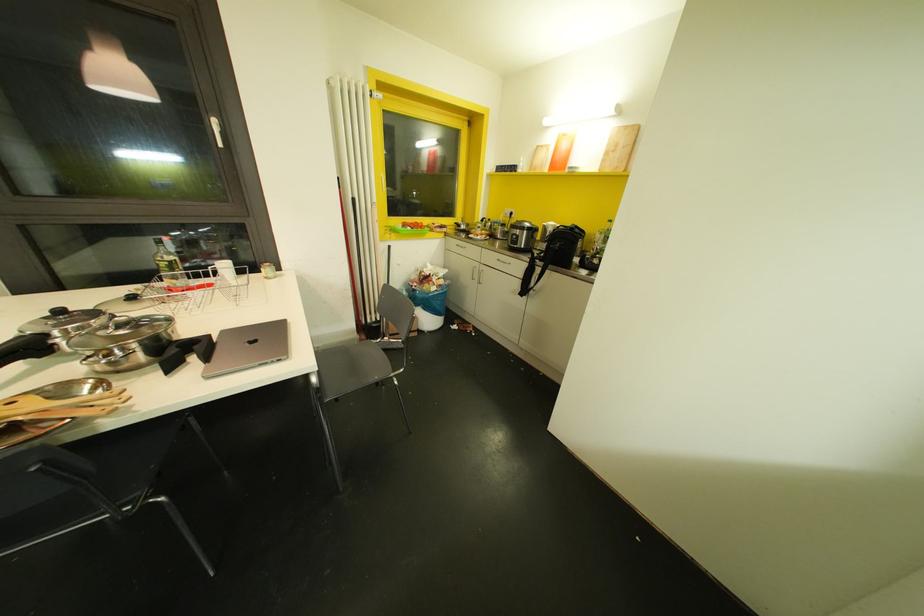
Which object does [69,411] point to?

It corresponds to the wooden cooking utensil in the image.